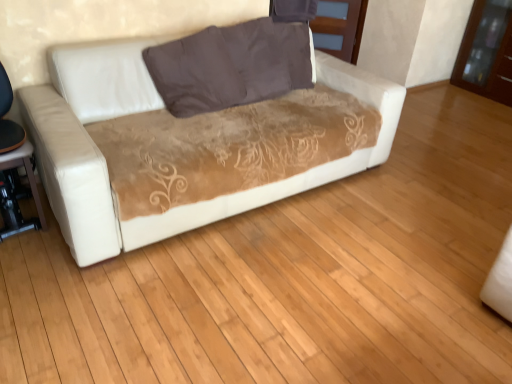
The image size is (512, 384). In order to click on free spot in front of white leather couch at center in this screenshot , I will do `click(230, 314)`.